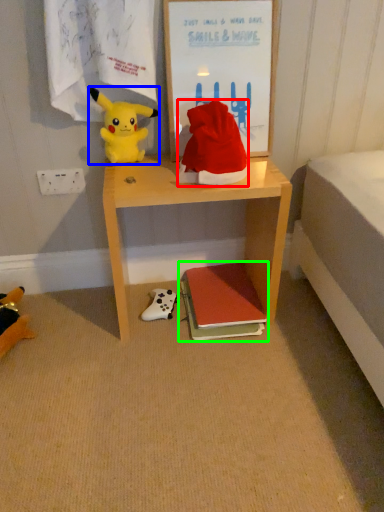
Question: Based on their relative distances, which object is farther from hat (highlighted by a red box)? Choose from toy (highlighted by a blue box) and book (highlighted by a green box).

Choices:
 (A) toy
 (B) book

Answer: (B)